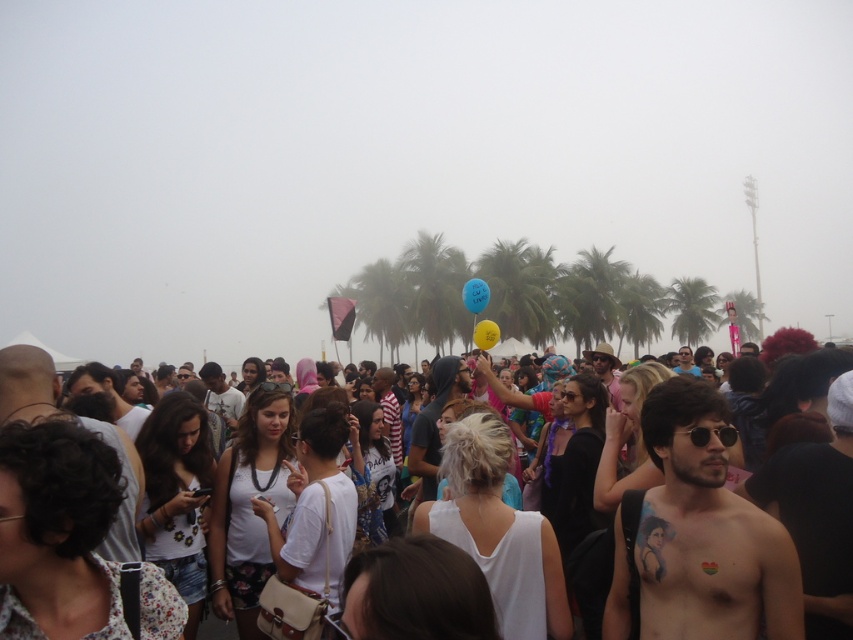
Question: Is yellow matte balloon at upper center positioned behind yellow rubber balloon at center?

Choices:
 (A) yes
 (B) no

Answer: (A)

Question: Which of the following is the closest to the observer?

Choices:
 (A) (779, 342)
 (B) (488, 336)

Answer: (A)

Question: Is white cotton crowd at center further to the viewer compared to yellow rubber balloon at center?

Choices:
 (A) yes
 (B) no

Answer: (B)

Question: Which of the following is the farthest from the observer?

Choices:
 (A) (479, 296)
 (B) (824, 600)

Answer: (A)

Question: Can you confirm if white cotton crowd at center is wider than yellow matte balloon at upper center?

Choices:
 (A) no
 (B) yes

Answer: (B)

Question: Considering the real-world distances, which object is closest to the white cotton crowd at center?

Choices:
 (A) yellow rubber balloon at center
 (B) yellow matte balloon at upper center

Answer: (A)